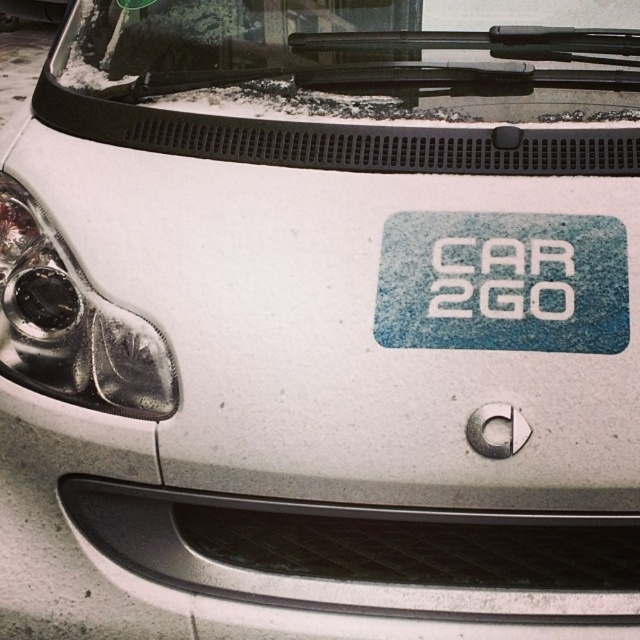
Question: Which point is closer to the camera?

Choices:
 (A) (570, 289)
 (B) (564, 116)

Answer: (A)

Question: Which point is farther to the camera?

Choices:
 (A) (100, 24)
 (B) (440, 256)

Answer: (A)

Question: Where is transparent glass windshield at upper center located in relation to blue textured sticker at center in the image?

Choices:
 (A) right
 (B) left

Answer: (B)

Question: Is transparent glass windshield at upper center further to camera compared to blue textured sticker at center?

Choices:
 (A) no
 (B) yes

Answer: (B)

Question: In this image, where is transparent glass windshield at upper center located relative to blue textured sticker at center?

Choices:
 (A) right
 (B) left

Answer: (B)

Question: Which of the following is the farthest from the observer?

Choices:
 (A) blue textured sticker at center
 (B) transparent glass windshield at upper center

Answer: (B)